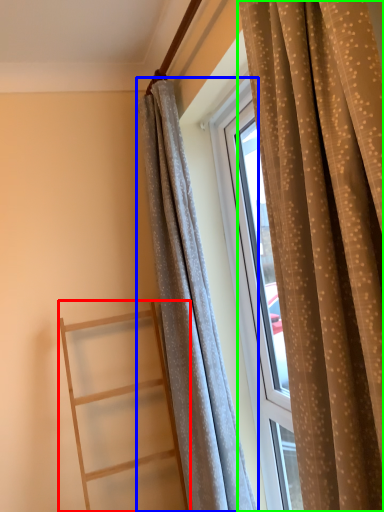
Question: Based on their relative distances, which object is farther from ladder (highlighted by a red box)? Choose from curtain (highlighted by a blue box) and curtain (highlighted by a green box).

Choices:
 (A) curtain
 (B) curtain

Answer: (B)